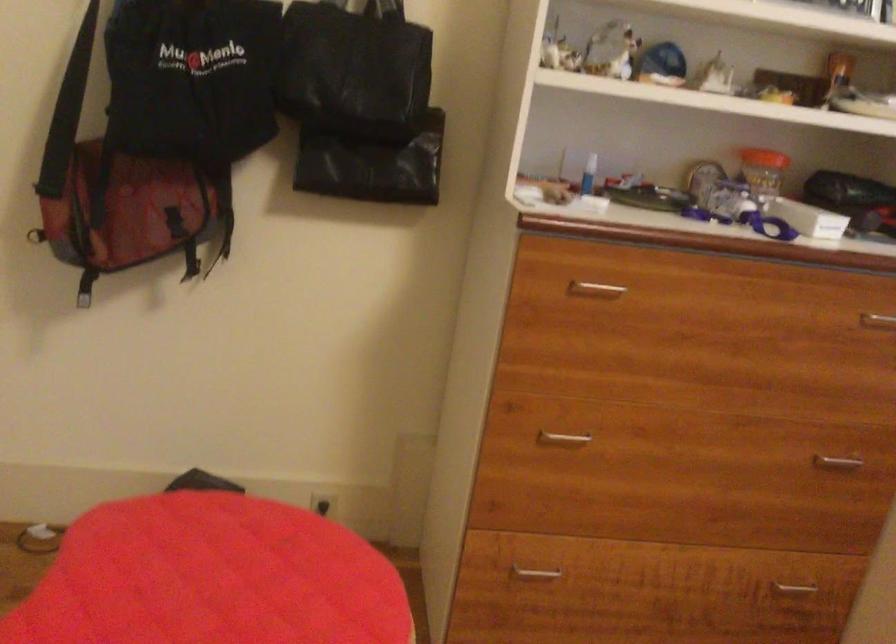
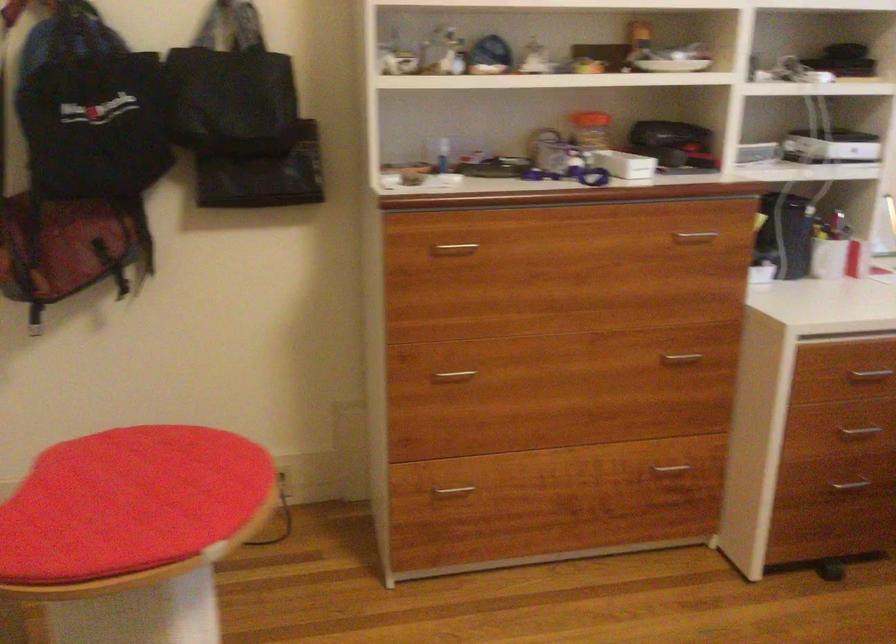
Question: Based on the continuous images, in which direction is the camera rotating? Reply with the corresponding letter.

Choices:
 (A) Left
 (B) Right
 (C) Up
 (D) Down

Answer: (B)